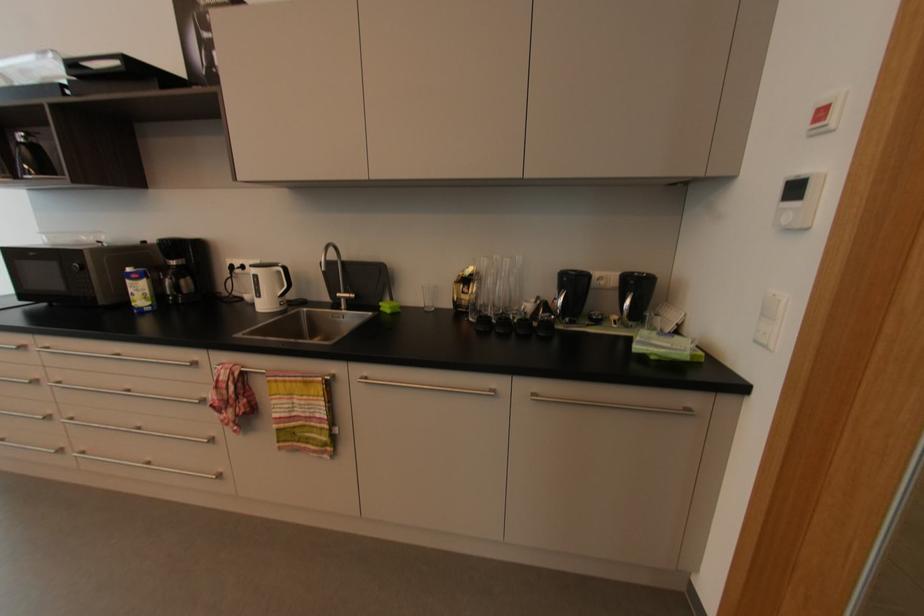
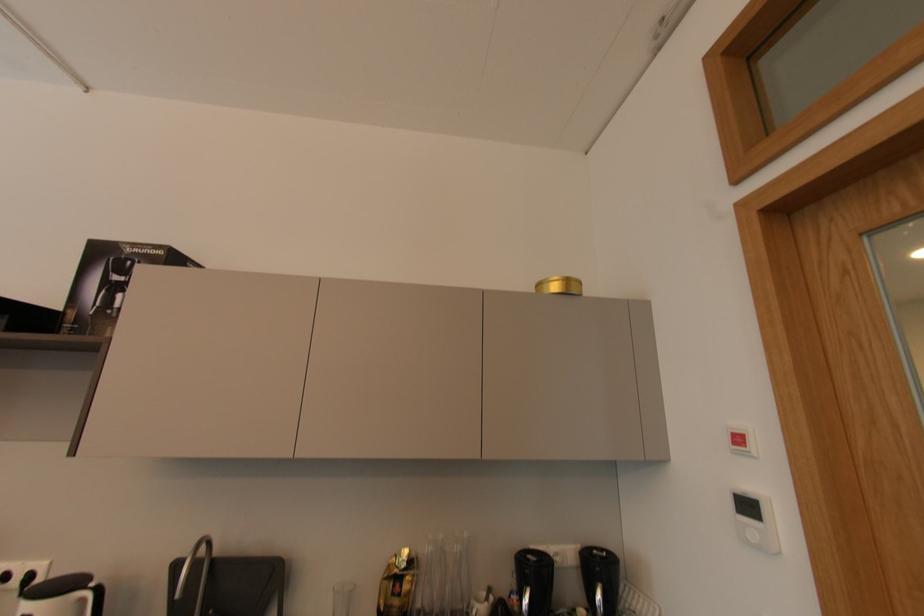
The images are taken continuously from a first-person perspective. In which direction is your viewpoint rotating?

The camera rotated toward right-up.